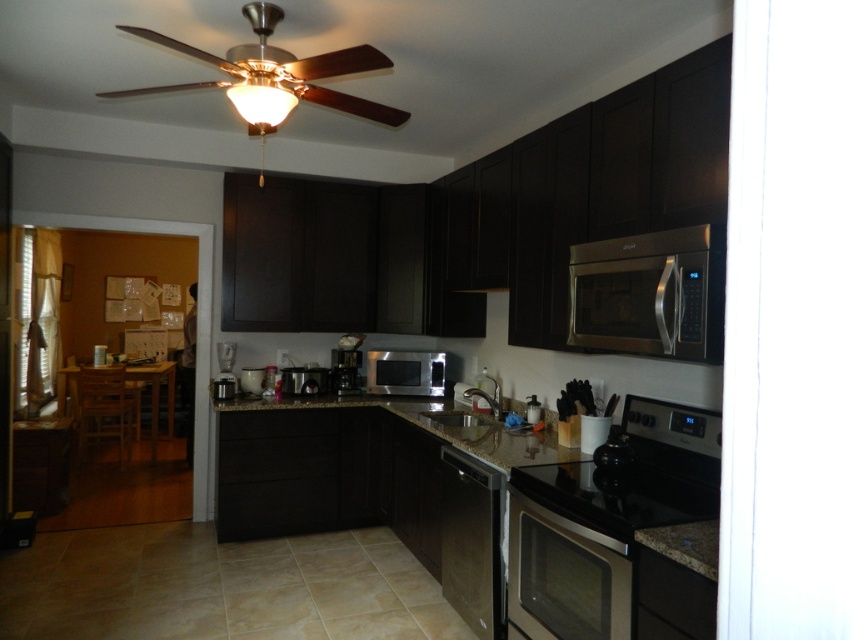
Is satin silver microwave at center to the left of satin black coffee maker at center from the viewer's perspective?

No, satin silver microwave at center is not to the left of satin black coffee maker at center.

Does satin silver microwave at center have a lesser height compared to satin black coffee maker at center?

In fact, satin silver microwave at center may be taller than satin black coffee maker at center.

Locate an element on the screen. The image size is (853, 640). satin silver microwave at center is located at coordinates click(x=405, y=371).

Is point (693, 328) positioned behind point (498, 536)?

No, (693, 328) is in front of (498, 536).

This screenshot has height=640, width=853. What do you see at coordinates (650, 292) in the screenshot?
I see `stainless steel microwave at upper right` at bounding box center [650, 292].

Does point (701, 307) lie behind point (466, 580)?

No, it is in front of (466, 580).

In order to click on stainless steel microwave at upper right in this screenshot , I will do `click(650, 292)`.

Measure the distance from stainless steel microwave at upper right to satin black microwave at center.

stainless steel microwave at upper right and satin black microwave at center are 2.54 meters apart.

Between stainless steel microwave at upper right and satin black microwave at center, which one has less height?

satin black microwave at center is shorter.

In order to click on stainless steel microwave at upper right in this screenshot , I will do `click(650, 292)`.

The image size is (853, 640). I want to click on stainless steel microwave at upper right, so click(x=650, y=292).